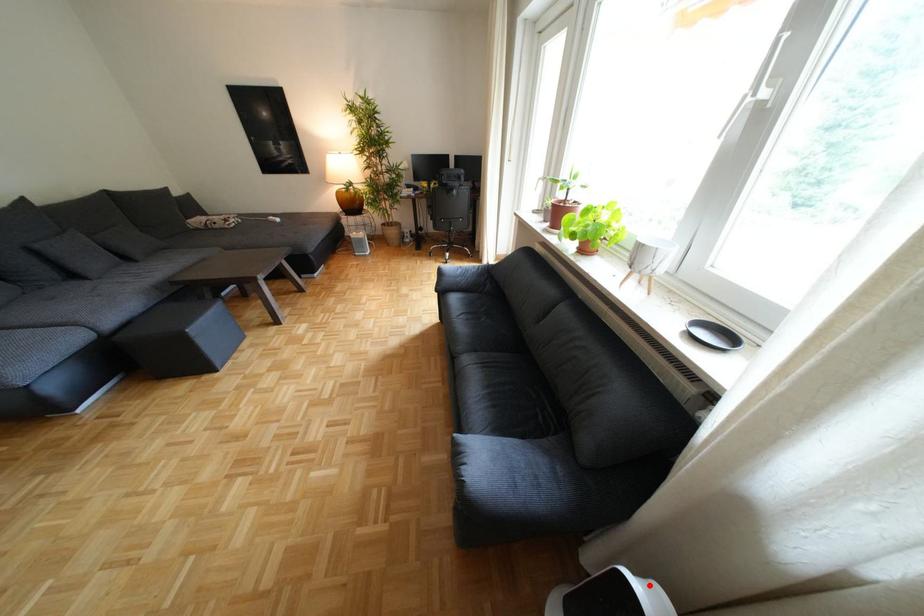
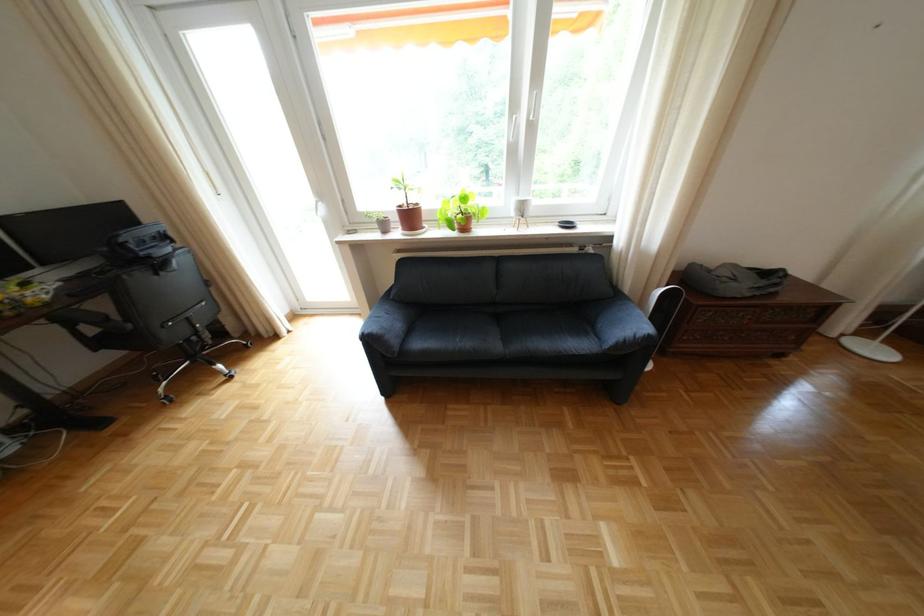
Question: A red point is marked in image1. In image2, is the corresponding 3D point closer to the camera or farther? Reply with the corresponding letter.

Choices:
 (A) The corresponding 3D point is closer.
 (B) The corresponding 3D point is farther.

Answer: (A)